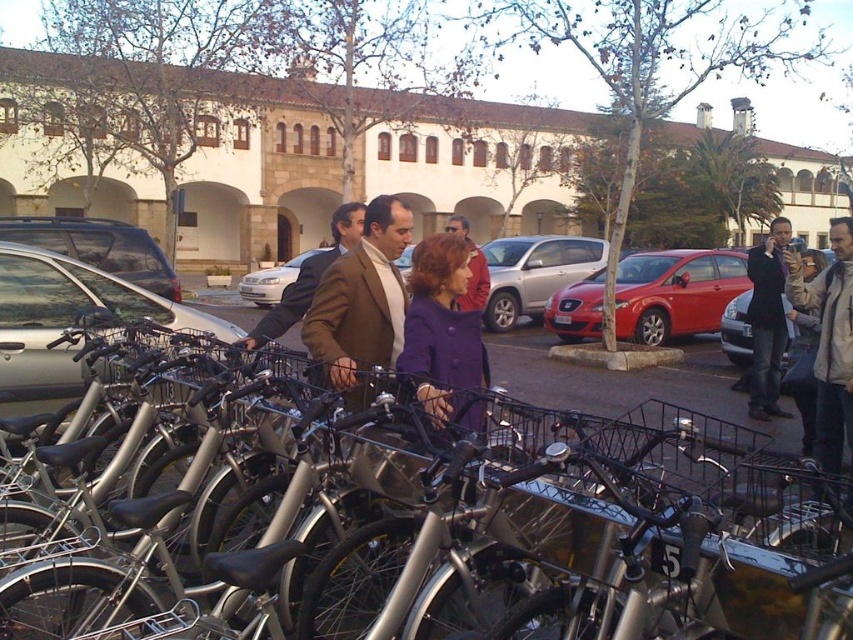
You are standing at the center of the image and want to walk directly to the dark brown leather jacket at right. What direction should you move in?

You should move to the right to reach the dark brown leather jacket at right since it is located at the right side of the image.

You are a delivery person trying to park your delivery van between the metallic silver car at left and the silver metallic car at center. The van requires a minimum height clearance of 1.8 meters. Can you safely park there based on the height difference between the two cars?

The metallic silver car at left is not as tall as silver metallic car at center. Since the van requires a minimum height clearance of 1.8 meters, you need to check the height of the taller car. However, the description only states the relative height between them but does not provide specific measurements. Without knowing the actual height of the taller car, it is uncertain if the clearance requirement is met. Please verify the exact height of the silver metallic car at center before deciding to park.

You are a tailor measuring jackets for alterations. You observe the dark brown leather jacket at right and the matte brown coat at center. Which jacket requires a wider alteration to accommodate the wearer?

The dark brown leather jacket at right requires a wider alteration since it is wider than the matte brown coat at center.